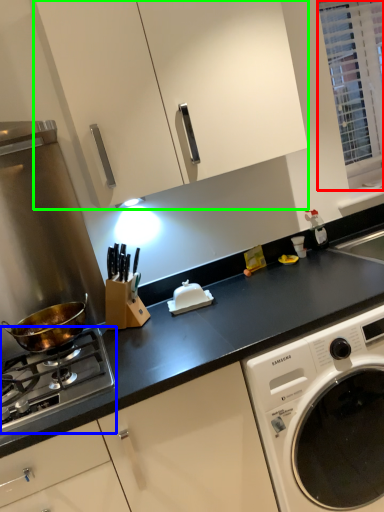
Question: Based on their relative distances, which object is farther from window (highlighted by a red box)? Choose from gas stove (highlighted by a blue box) and cabinetry (highlighted by a green box).

Choices:
 (A) gas stove
 (B) cabinetry

Answer: (A)